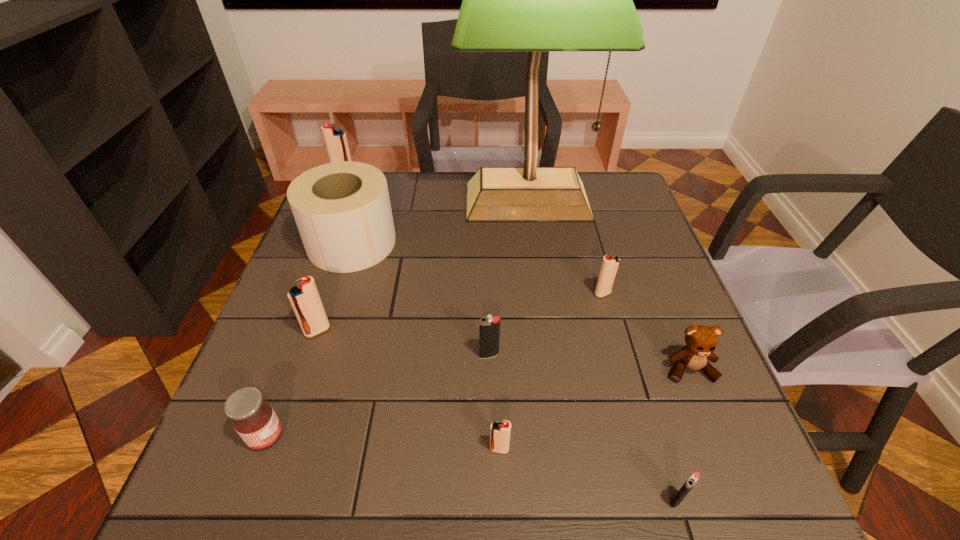
Where is `the second farthest igniter`? the second farthest igniter is located at coordinates (610, 264).

The image size is (960, 540). In order to click on jam in this screenshot , I will do `click(254, 419)`.

I want to click on teddy bear, so click(x=701, y=341).

I want to click on the rightmost object, so [x=701, y=341].

Locate an element on the screen. This screenshot has width=960, height=540. the smallest red igniter is located at coordinates (500, 431).

Where is `the fifth farthest igniter`? the fifth farthest igniter is located at coordinates (500, 431).

This screenshot has width=960, height=540. I want to click on the right black igniter, so click(693, 479).

Identify the location of the nearest object. The height and width of the screenshot is (540, 960). (693, 479).

Locate an element on the screen. This screenshot has height=540, width=960. vacant space positioned on the metallic stand of the green table lamp is located at coordinates (541, 306).

At what (x,y) coordinates should I click in order to perform the action: click on free region located on the right of the leftmost red igniter. Please return your answer as a coordinate pair (x, y). This screenshot has width=960, height=540. Looking at the image, I should click on (463, 178).